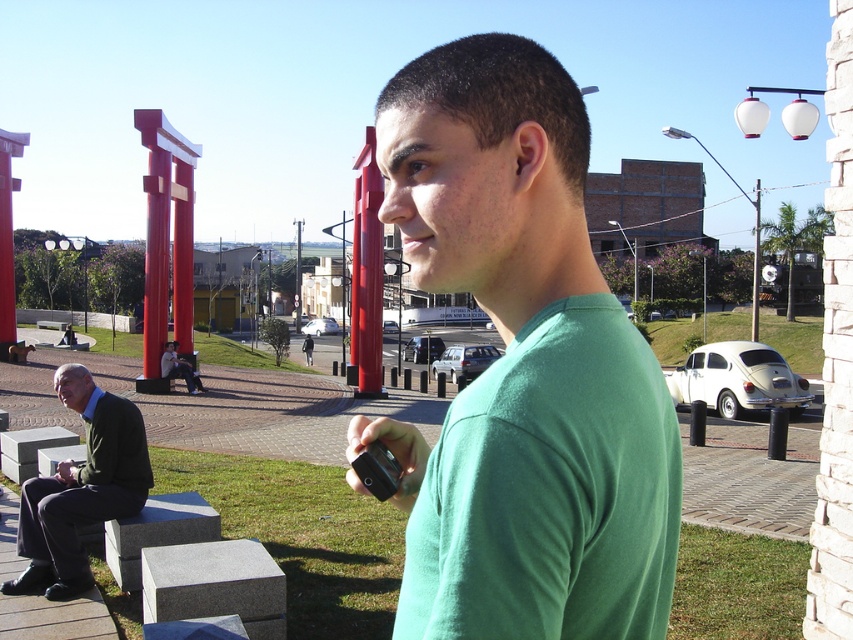
Question: Does green matte shirt at center appear on the left side of dark green suit at lower left?

Choices:
 (A) yes
 (B) no

Answer: (B)

Question: Does green t-shirt at center appear on the left side of matte black phone at lower left?

Choices:
 (A) no
 (B) yes

Answer: (B)

Question: Which of these objects is positioned closest to the matte black phone at lower left?

Choices:
 (A) black matte phone at center
 (B) smooth glossy red torii gate at center

Answer: (A)

Question: Which object is closer to the camera taking this photo?

Choices:
 (A) matte black phone at lower left
 (B) dark green suit at lower left

Answer: (B)

Question: Which of the following is the farthest from the observer?

Choices:
 (A) black matte phone at center
 (B) matte black phone at lower left
 (C) dark green suit at lower left

Answer: (B)

Question: Does green t-shirt at center appear on the left side of matte black phone at lower left?

Choices:
 (A) yes
 (B) no

Answer: (A)